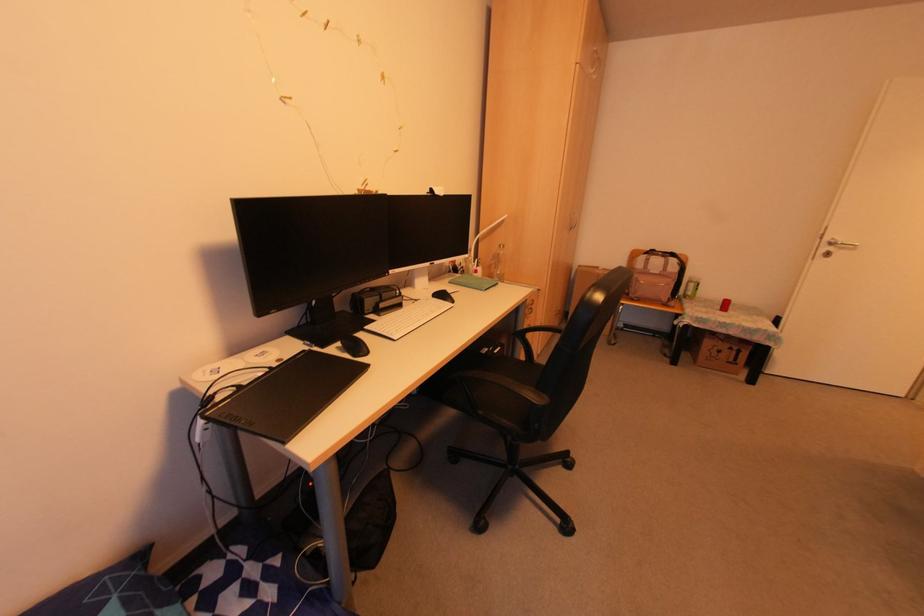
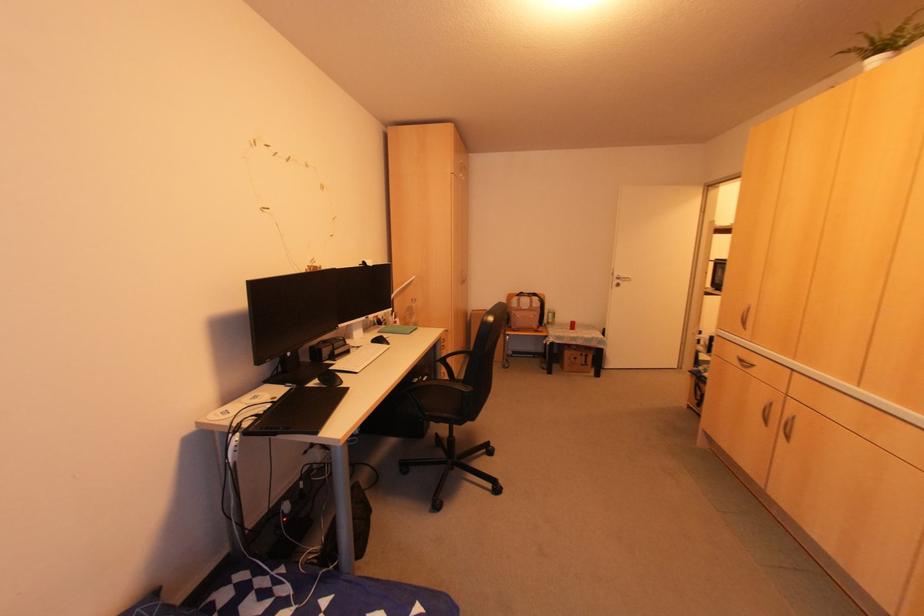
Question: How did the camera likely rotate?

Choices:
 (A) Left
 (B) Right
 (C) Up
 (D) Down

Answer: (B)